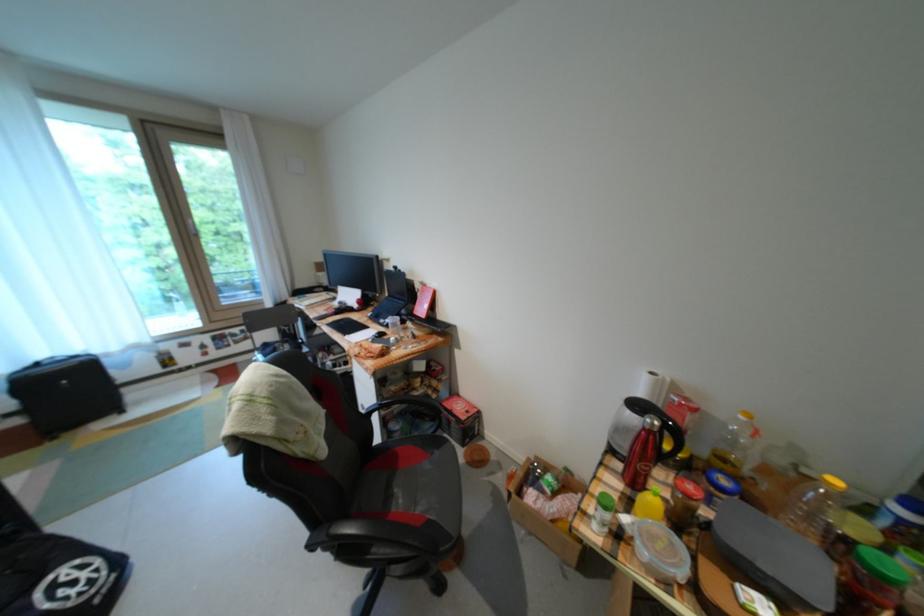
What do you see at coordinates (671, 439) in the screenshot?
I see `a kettle handle` at bounding box center [671, 439].